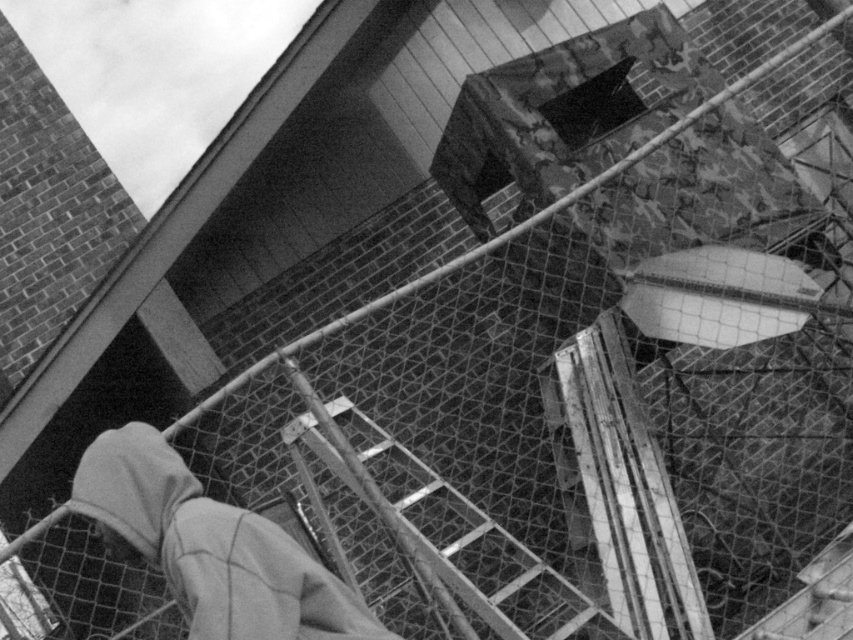
Does gray fleece hoodie at lower left have a greater width compared to metallic silver ladder at center?

Correct, the width of gray fleece hoodie at lower left exceeds that of metallic silver ladder at center.

Find the location of a particular element. gray fleece hoodie at lower left is located at coordinates (212, 547).

This screenshot has width=853, height=640. What do you see at coordinates (212, 547) in the screenshot?
I see `gray fleece hoodie at lower left` at bounding box center [212, 547].

Locate an element on the screen. gray fleece hoodie at lower left is located at coordinates (212, 547).

Who is positioned more to the left, metallic silver ladder at center or wooden at center?

wooden at center

Is the position of metallic silver ladder at center more distant than that of wooden at center?

Yes, it is.

Locate an element on the screen. The width and height of the screenshot is (853, 640). metallic silver ladder at center is located at coordinates (618, 488).

Does gray fleece hoodie at lower left appear on the left side of wooden at center?

Correct, you'll find gray fleece hoodie at lower left to the left of wooden at center.

Does gray fleece hoodie at lower left have a greater width compared to wooden at center?

No.

Does point (206, 628) come in front of point (357, 580)?

Yes, point (206, 628) is closer to viewer.

Identify the location of gray fleece hoodie at lower left. This screenshot has height=640, width=853. (212, 547).